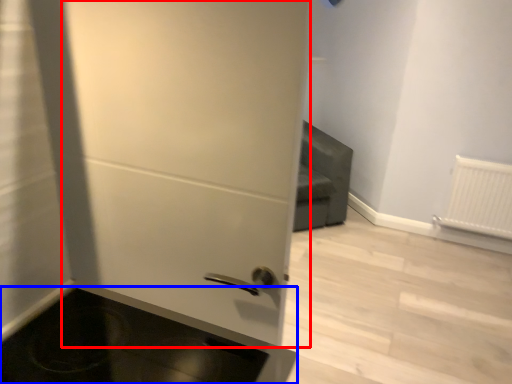
Question: Which object appears closest to the camera in this image, door (highlighted by a red box) or appliance (highlighted by a blue box)?

Choices:
 (A) door
 (B) appliance

Answer: (B)